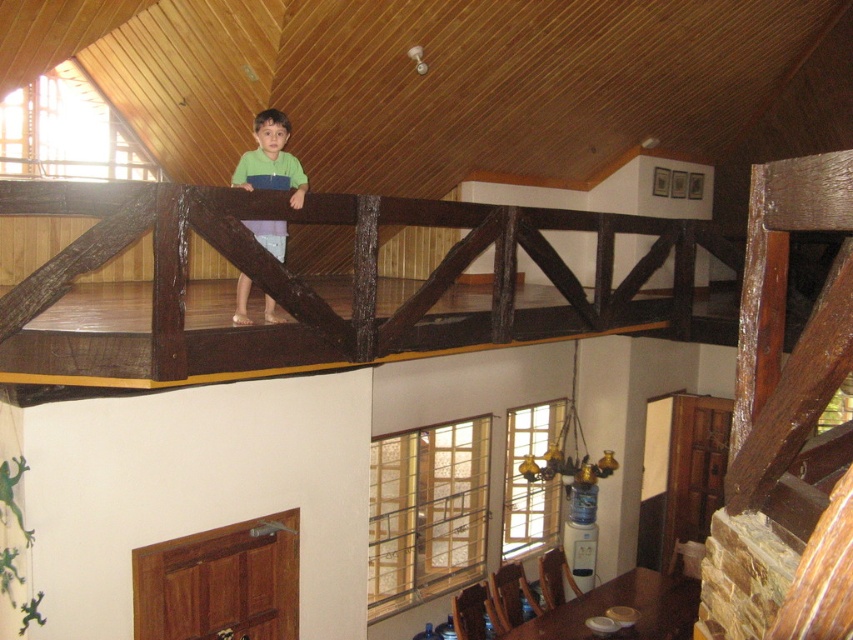
You are standing at point (258,182) and want to move to the dining area table. Is the dining area table located in front of or behind point (294,308)?

The dining area table is in front of point (294,308) because point (294,308) is in front of point (258,182) where you are standing.

You are a parent checking the safety of the loft bed in the image. You see the dark brown wood at upper center and the green matte shirt at upper center. Which object is positioned lower in the scene?

The dark brown wood at upper center is located below the green matte shirt at upper center, so the dark brown wood at upper center is positioned lower in the scene.